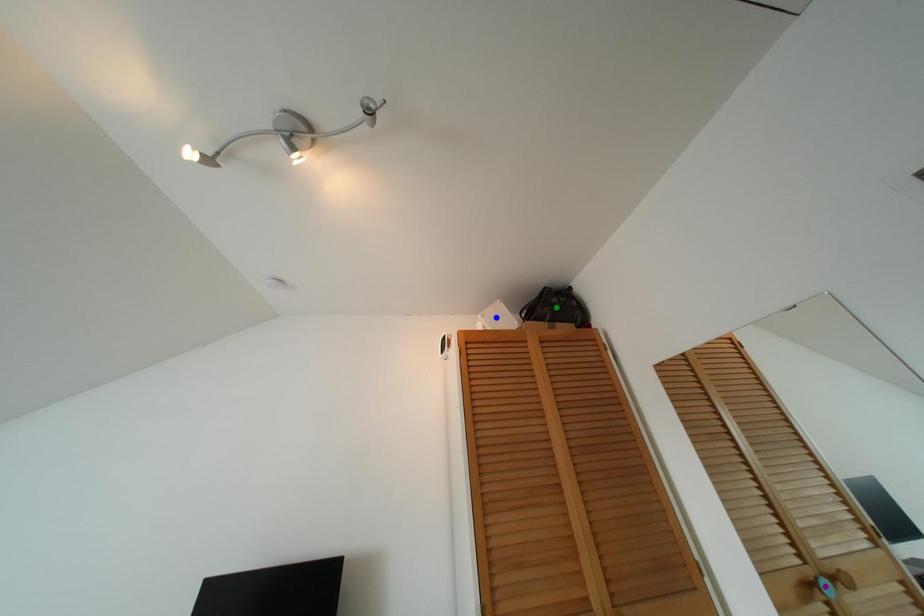
Order these from nearest to farthest:
- green point
- blue point
- purple point

purple point
blue point
green point